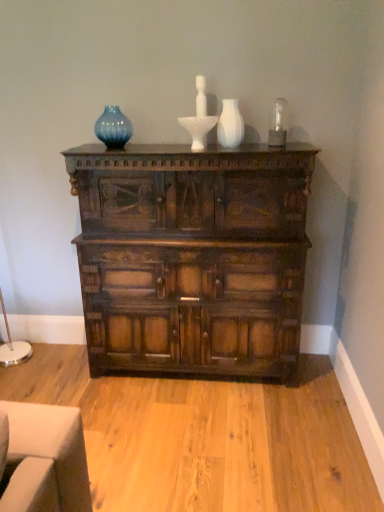
The height and width of the screenshot is (512, 384). I want to click on free spot above blue glass vase at upper center (from a real-world perspective), so click(107, 101).